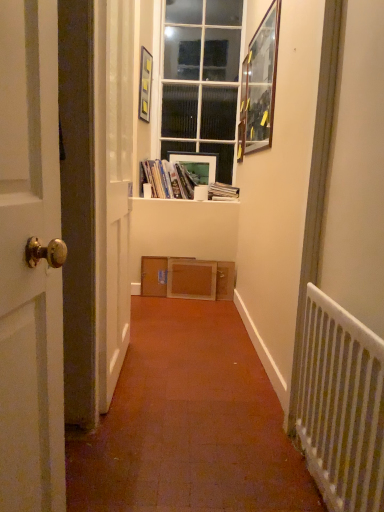
Question: Is hardcover book at center inside white cardboard at center?

Choices:
 (A) yes
 (B) no

Answer: (B)

Question: Can you confirm if white cardboard at center is positioned to the right of hardcover book at center?

Choices:
 (A) yes
 (B) no

Answer: (B)

Question: Is white cardboard at center turned away from hardcover book at center?

Choices:
 (A) yes
 (B) no

Answer: (B)

Question: Is white cardboard at center thinner than hardcover book at center?

Choices:
 (A) yes
 (B) no

Answer: (B)

Question: From the image's perspective, is white cardboard at center located beneath hardcover book at center?

Choices:
 (A) yes
 (B) no

Answer: (A)

Question: Is point (44, 164) closer or farther from the camera than point (231, 202)?

Choices:
 (A) closer
 (B) farther

Answer: (A)

Question: From the image's perspective, is white wooden door at left located above or below white cardboard at center?

Choices:
 (A) above
 (B) below

Answer: (B)

Question: Is white wooden door at left situated inside white cardboard at center or outside?

Choices:
 (A) outside
 (B) inside

Answer: (A)

Question: Considering the positions of white wooden door at left and white cardboard at center in the image, is white wooden door at left bigger or smaller than white cardboard at center?

Choices:
 (A) small
 (B) big

Answer: (B)

Question: From the image's perspective, is white metal radiator at right located above or below hardcover book at center?

Choices:
 (A) above
 (B) below

Answer: (B)

Question: Visually, is white metal radiator at right positioned to the left or to the right of hardcover book at center?

Choices:
 (A) left
 (B) right

Answer: (B)

Question: Does point (370, 480) appear closer or farther from the camera than point (236, 186)?

Choices:
 (A) farther
 (B) closer

Answer: (B)

Question: Do you think white metal radiator at right is within hardcover book at center, or outside of it?

Choices:
 (A) outside
 (B) inside

Answer: (A)

Question: Considering their positions, is hardcover book at center located in front of or behind matte glass picture frame at upper center, the 1th picture frame in the left-to-right sequence?

Choices:
 (A) behind
 (B) front

Answer: (A)

Question: Looking at the image, does hardcover book at center seem bigger or smaller compared to matte glass picture frame at upper center, the second picture frame positioned from the front?

Choices:
 (A) small
 (B) big

Answer: (B)